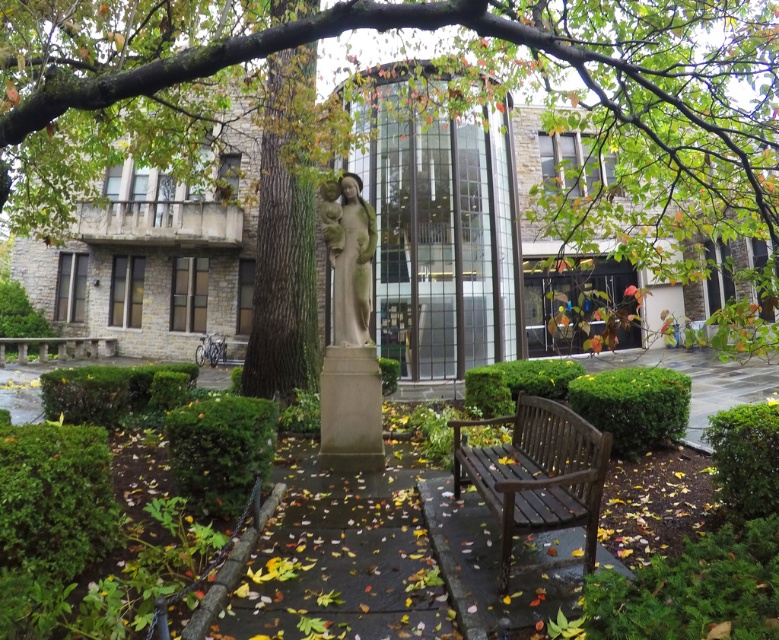
Question: Can you confirm if dark brown wooden bench at lower right is bigger than stone statue at center?

Choices:
 (A) no
 (B) yes

Answer: (B)

Question: Which object is the farthest from the green leafy tree at center?

Choices:
 (A) stone statue at center
 (B) dark brown wooden bench at lower right

Answer: (B)

Question: Which object is the farthest from the dark brown wooden bench at lower right?

Choices:
 (A) green leafy tree at center
 (B) stone statue at center

Answer: (A)

Question: Does dark brown wooden bench at lower right come in front of stone statue at center?

Choices:
 (A) yes
 (B) no

Answer: (A)

Question: Which of the following is the closest to the observer?

Choices:
 (A) stone statue at center
 (B) green leafy tree at center
 (C) dark brown wooden bench at lower right

Answer: (B)

Question: Considering the relative positions of green leafy tree at center and dark brown wooden bench at lower right in the image provided, where is green leafy tree at center located with respect to dark brown wooden bench at lower right?

Choices:
 (A) right
 (B) left

Answer: (A)